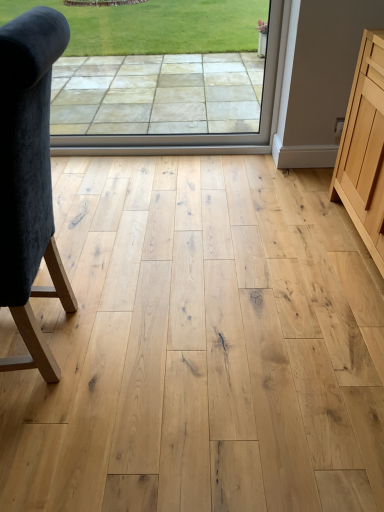
The image size is (384, 512). In order to click on free space between transparent glass window at center and natural wood cabinet at right in this screenshot , I will do `click(224, 198)`.